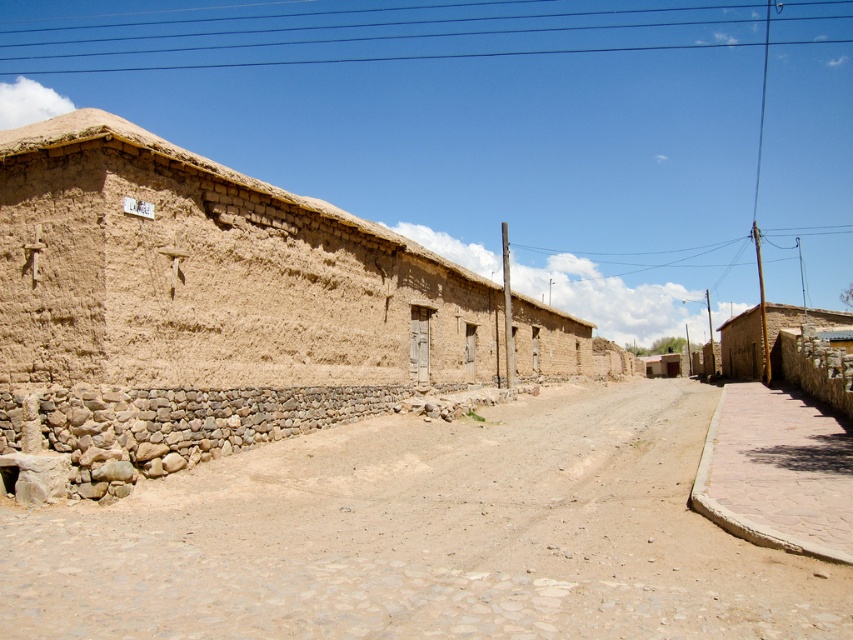
You are standing on the dusty street in this rural scene. Looking at the brown mud hut at left and the brown adobe hut at right, which one is positioned higher up from the ground level?

The brown mud hut at left is above the brown adobe hut at right, so it is positioned higher up from the ground level.

You are a traveler standing at the center of the rural street. You see the brown mud hut at left and the brown adobe hut at right. If you want to visit both huts, which one should you walk towards first to minimize the total distance you walk?

To minimize the total distance walked, you should visit the brown mud hut at left first, then the brown adobe hut at right, since the distance between them is 67.33 feet. Walking to the closer one first doesn